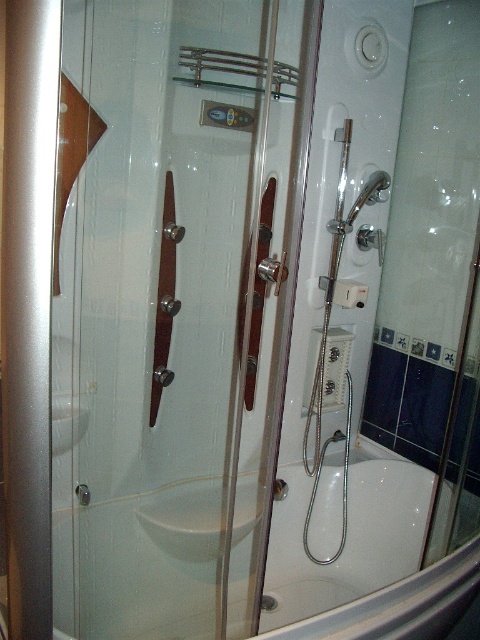
In the scene shown: How distant is transparent glass door at center from white glossy bathtub at center?

23.67 inches

Which is in front, point (72, 252) or point (380, 634)?

Point (380, 634) is more forward.

At what (x,y) coordinates should I click in order to perform the action: click on transparent glass door at center. Please return your answer as a coordinate pair (x, y). Looking at the image, I should click on (178, 312).

Between satin silver screen door at left and white glossy bathtub at center, which one is positioned higher?

Positioned higher is satin silver screen door at left.

Describe the element at coordinates (28, 305) in the screenshot. The height and width of the screenshot is (640, 480). I see `satin silver screen door at left` at that location.

Where is `satin silver screen door at left`? This screenshot has height=640, width=480. satin silver screen door at left is located at coordinates (28, 305).

Who is positioned more to the right, transparent glass door at center or satin silver screen door at left?

transparent glass door at center is more to the right.

Between transparent glass door at center and satin silver screen door at left, which one has less height?

satin silver screen door at left is shorter.

Is point (136, 64) closer to camera compared to point (7, 257)?

That is False.

This screenshot has height=640, width=480. I want to click on transparent glass door at center, so click(x=178, y=312).